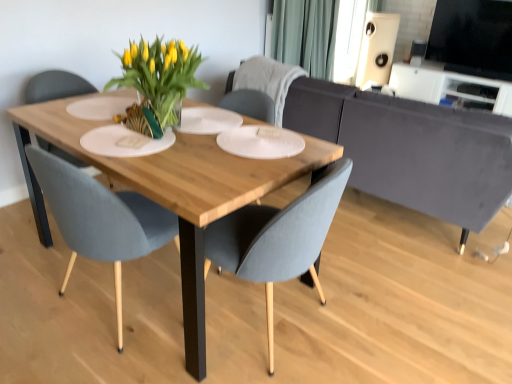
Locate an element on the screen. free location in front of matte gray chair at center, marked as the 2th chair in a back-to-front arrangement is located at coordinates (82, 362).